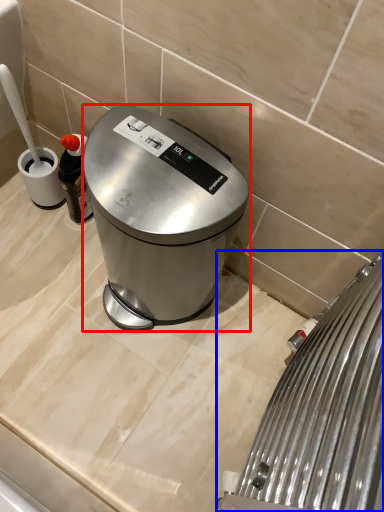
Question: Which of the following is the closest to the observer, kitchen appliance (highlighted by a red box) or home appliance (highlighted by a blue box)?

Choices:
 (A) kitchen appliance
 (B) home appliance

Answer: (B)